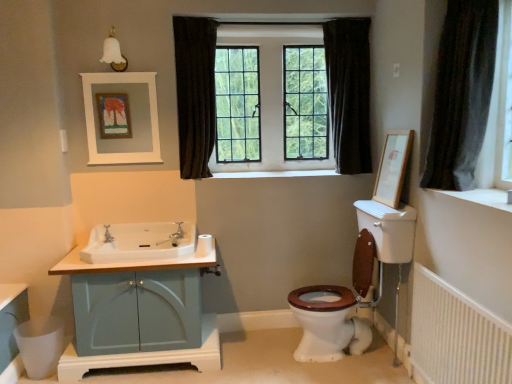
Where is `blank area beneath dark fabric curtain at upper right, the first curtain when ordered from front to back (from a real-world perspective)`? This screenshot has width=512, height=384. blank area beneath dark fabric curtain at upper right, the first curtain when ordered from front to back (from a real-world perspective) is located at coordinates (453, 187).